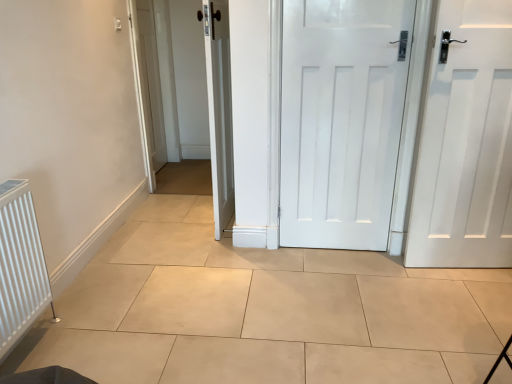
Find the location of a particular element. free space in front of white matte door at right, which is the 1th door in right-to-left order is located at coordinates (473, 307).